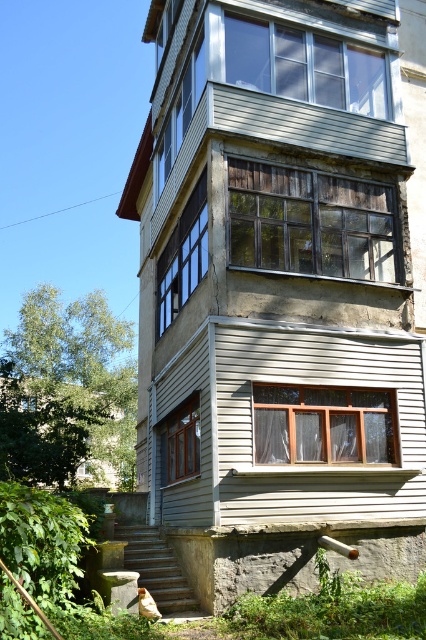
Question: Which is farther from the clear glass window at upper center?

Choices:
 (A) wooden frame at lower center
 (B) wooden window at center
 (C) translucent wood window at center
 (D) wooden frame at center

Answer: (A)

Question: Considering the relative positions of wooden window at center and wooden frame at center in the image provided, where is wooden window at center located with respect to wooden frame at center?

Choices:
 (A) right
 (B) left

Answer: (A)

Question: Is clear glass window at upper center positioned in front of translucent wood window at center?

Choices:
 (A) yes
 (B) no

Answer: (B)

Question: Which of the following is the farthest from the observer?

Choices:
 (A) wooden frame at center
 (B) wooden frame at lower center
 (C) wooden window at center

Answer: (A)

Question: Considering the relative positions of translucent wood window at center and wooden frame at lower center in the image provided, where is translucent wood window at center located with respect to wooden frame at lower center?

Choices:
 (A) right
 (B) left

Answer: (A)

Question: Based on their relative distances, which object is farther from the clear glass window at upper center?

Choices:
 (A) wooden window at center
 (B) wooden frame at lower center
 (C) translucent wood window at center
 (D) wooden frame at center

Answer: (B)